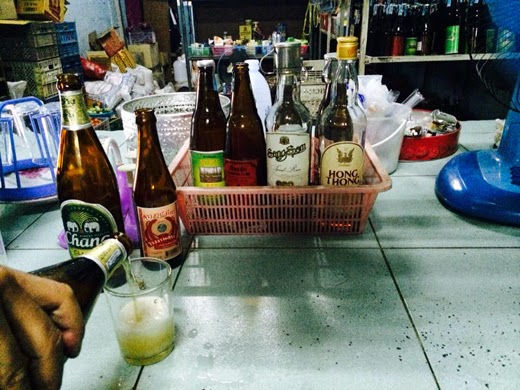
Find the location of a particular element. boxes is located at coordinates (152, 54).